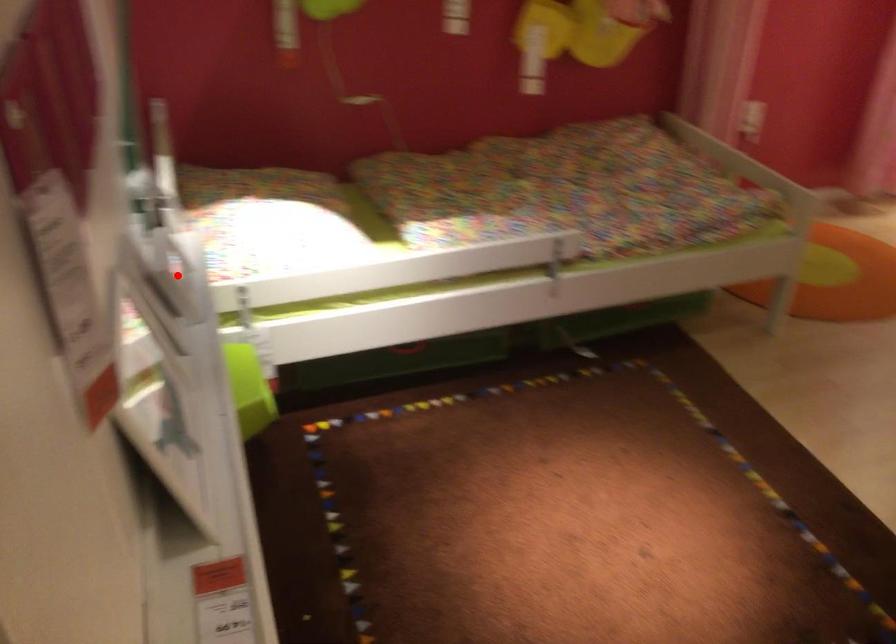
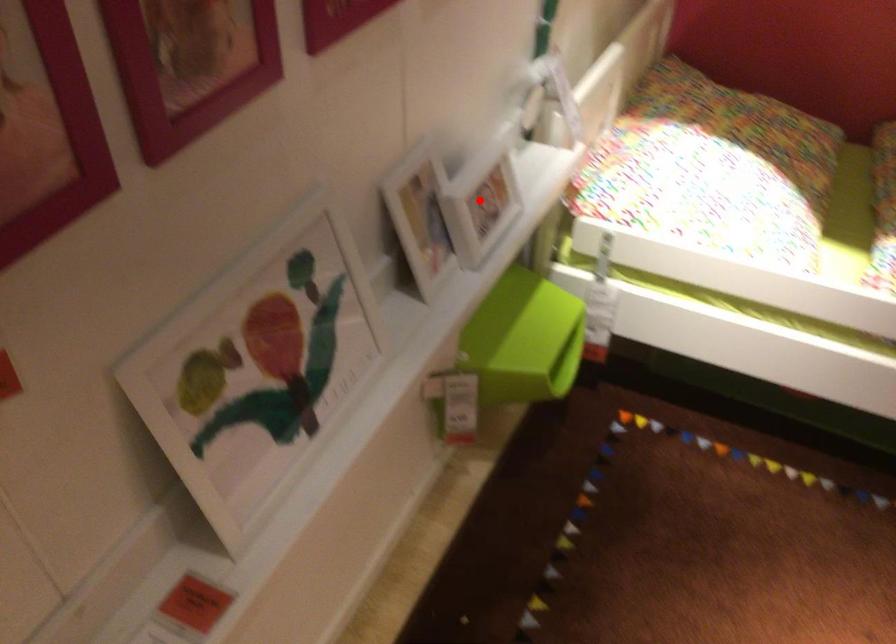
I am providing you with two images of the same scene from different viewpoints. A red point is marked on the first image and another point is marked on the second image. Are the points marked in image1 and image2 representing the same 3D position?

Yes